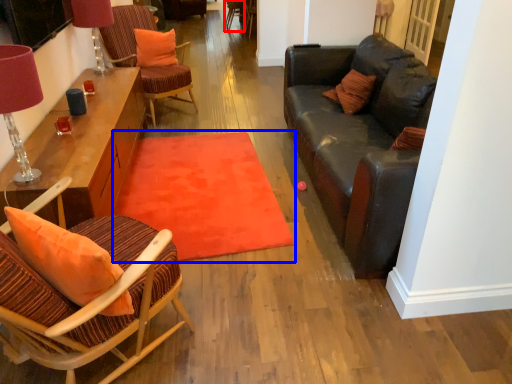
Question: Which object appears farthest to the camera in this image, armchair (highlighted by a red box) or mat (highlighted by a blue box)?

Choices:
 (A) armchair
 (B) mat

Answer: (A)